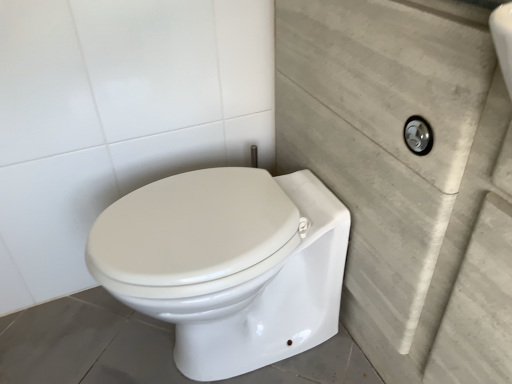
Where is `white glossy bidet at center`? Image resolution: width=512 pixels, height=384 pixels. white glossy bidet at center is located at coordinates (227, 264).

Describe the element at coordinates (227, 264) in the screenshot. I see `white glossy bidet at center` at that location.

Image resolution: width=512 pixels, height=384 pixels. In order to click on white glossy bidet at center in this screenshot , I will do `click(227, 264)`.